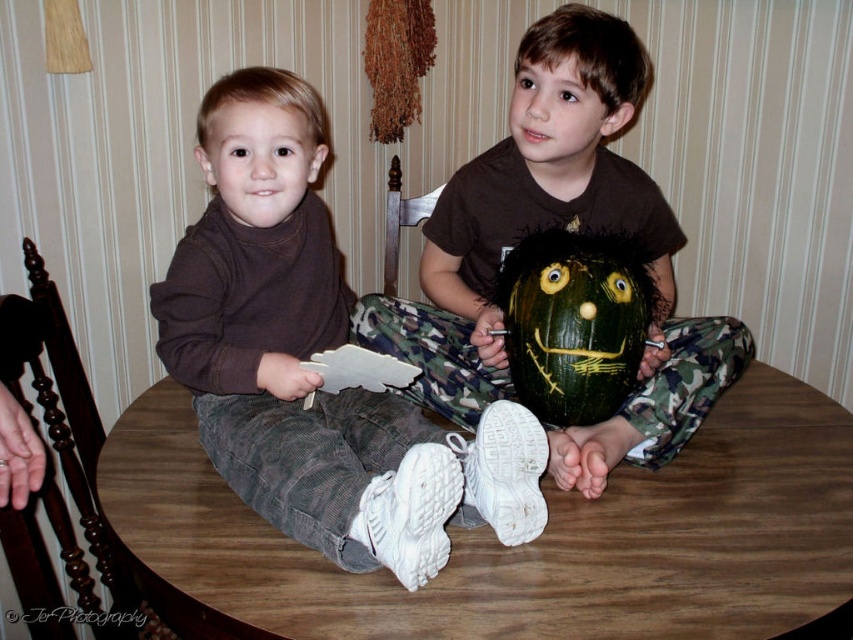
Can you confirm if green matte pumpkin at center is thinner than smooth brown face at upper center?

Incorrect, green matte pumpkin at center's width is not less than smooth brown face at upper center's.

Based on the photo, between green matte pumpkin at center and smooth brown face at upper center, which one is positioned lower?

Positioned lower is green matte pumpkin at center.

Who is more forward, (453, 179) or (548, 84)?

Point (548, 84)

Where is `green matte pumpkin at center`? green matte pumpkin at center is located at coordinates (561, 227).

Does brown cotton sweater at left have a lesser height compared to green matte pumpkin at center?

Yes.

Measure the distance between point (323,112) and camera.

The distance of point (323,112) from camera is 1.65 meters.

Describe the element at coordinates (310, 353) in the screenshot. The height and width of the screenshot is (640, 853). I see `brown cotton sweater at left` at that location.

Locate an element on the screen. Image resolution: width=853 pixels, height=640 pixels. brown cotton sweater at left is located at coordinates (310, 353).

Based on the photo, is brown cotton sweater at left closer to camera compared to matte brown turtleneck at center?

Yes, it is.

Is brown cotton sweater at left wider than matte brown turtleneck at center?

Yes.

From the picture: Measure the distance between brown cotton sweater at left and camera.

brown cotton sweater at left and camera are 79.76 centimeters apart.

The width and height of the screenshot is (853, 640). Identify the location of brown cotton sweater at left. (310, 353).